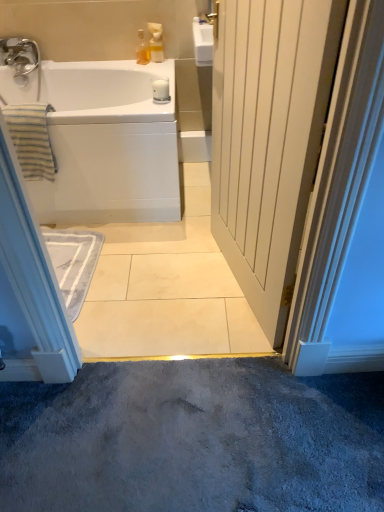
What do you see at coordinates (156, 42) in the screenshot? I see `white glossy soap dispenser at upper center, marked as the 2th toiletry in a left-to-right arrangement` at bounding box center [156, 42].

Describe the element at coordinates (109, 144) in the screenshot. This screenshot has width=384, height=512. I see `white glossy bathtub at upper left` at that location.

In order to click on white glossy soap dispenser at upper center, which is the first toiletry in right-to-left order in this screenshot , I will do `click(156, 42)`.

Can you confirm if white glossy bathtub at upper left is positioned to the right of white glossy soap dispenser at upper center, which is the first toiletry in right-to-left order?

Incorrect, white glossy bathtub at upper left is not on the right side of white glossy soap dispenser at upper center, which is the first toiletry in right-to-left order.

From the image's perspective, would you say white glossy bathtub at upper left is shown under white glossy soap dispenser at upper center, which is the first toiletry in right-to-left order?

Yes.

Which of these two, white glossy bathtub at upper left or white glossy soap dispenser at upper center, which is the first toiletry in right-to-left order, is smaller?

white glossy soap dispenser at upper center, which is the first toiletry in right-to-left order, is smaller.

Is white glossy bathtub at upper left oriented towards white glossy soap dispenser at upper center, which is the first toiletry in right-to-left order?

No, white glossy bathtub at upper left is not oriented towards white glossy soap dispenser at upper center, which is the first toiletry in right-to-left order.

Which is further, (x=146, y=59) or (x=22, y=134)?

Positioned behind is point (x=146, y=59).

How different are the orientations of translucent glass bottle at upper center, placed as the first toiletry when sorted from left to right, and striped cotton towel at left in degrees?

translucent glass bottle at upper center, placed as the first toiletry when sorted from left to right, and striped cotton towel at left are facing 30.7 degrees away from each other.

Between translucent glass bottle at upper center, marked as the second toiletry in a right-to-left arrangement, and striped cotton towel at left, which one has more height?

Standing taller between the two is striped cotton towel at left.

Which is more to the left, white wood door at center or white glossy soap dispenser at upper center, which is the first toiletry in right-to-left order?

Positioned to the left is white glossy soap dispenser at upper center, which is the first toiletry in right-to-left order.

Does white wood door at center have a smaller size compared to white glossy soap dispenser at upper center, marked as the 2th toiletry in a left-to-right arrangement?

No, white wood door at center is not smaller than white glossy soap dispenser at upper center, marked as the 2th toiletry in a left-to-right arrangement.

Does white wood door at center have a lesser width compared to white glossy soap dispenser at upper center, marked as the 2th toiletry in a left-to-right arrangement?

In fact, white wood door at center might be wider than white glossy soap dispenser at upper center, marked as the 2th toiletry in a left-to-right arrangement.

How many degrees apart are the facing directions of striped cotton towel at left and white glossy bathtub at upper left?

0.769 degrees separate the facing orientations of striped cotton towel at left and white glossy bathtub at upper left.

Can you see striped cotton towel at left touching white glossy bathtub at upper left?

striped cotton towel at left and white glossy bathtub at upper left are clearly separated.

Is striped cotton towel at left completely or partially outside of white glossy bathtub at upper left?

No.

Is point (41, 105) more distant than point (74, 182)?

Yes, point (41, 105) is farther from viewer.

Does point (147, 52) come farther from viewer compared to point (161, 42)?

No.

From the image's perspective, which one is positioned higher, translucent glass bottle at upper center, placed as the first toiletry when sorted from left to right, or white glossy soap dispenser at upper center, marked as the 2th toiletry in a left-to-right arrangement?

white glossy soap dispenser at upper center, marked as the 2th toiletry in a left-to-right arrangement, is shown above in the image.

Considering the relative sizes of translucent glass bottle at upper center, marked as the second toiletry in a right-to-left arrangement, and white glossy soap dispenser at upper center, marked as the 2th toiletry in a left-to-right arrangement, in the image provided, is translucent glass bottle at upper center, marked as the second toiletry in a right-to-left arrangement, thinner than white glossy soap dispenser at upper center, marked as the 2th toiletry in a left-to-right arrangement,?

Yes.

Is striped cotton towel at left with white glossy soap dispenser at upper center, marked as the 2th toiletry in a left-to-right arrangement?

striped cotton towel at left and white glossy soap dispenser at upper center, marked as the 2th toiletry in a left-to-right arrangement, are not in contact.

From the image's perspective, would you say striped cotton towel at left is positioned over white glossy soap dispenser at upper center, which is the first toiletry in right-to-left order?

No, from the image's perspective, striped cotton towel at left is not above white glossy soap dispenser at upper center, which is the first toiletry in right-to-left order.

Between striped cotton towel at left and white glossy soap dispenser at upper center, marked as the 2th toiletry in a left-to-right arrangement, which one has larger width?

With larger width is striped cotton towel at left.

Between striped cotton towel at left and white glossy soap dispenser at upper center, which is the first toiletry in right-to-left order, which one is positioned behind?

white glossy soap dispenser at upper center, which is the first toiletry in right-to-left order, is further from the camera.

Can you confirm if white wood door at center is bigger than white glossy bathtub at upper left?

No, white wood door at center is not bigger than white glossy bathtub at upper left.

Relative to white glossy bathtub at upper left, is white wood door at center in front or behind?

white wood door at center is in front of white glossy bathtub at upper left.

From the image's perspective, between white wood door at center and white glossy bathtub at upper left, which one is located above?

white glossy bathtub at upper left appears higher in the image.

At what (x,y) coordinates should I click in order to perform the action: click on door below the white glossy bathtub at upper left (from the image's perspective). Please return your answer as a coordinate pair (x, y). The width and height of the screenshot is (384, 512). Looking at the image, I should click on (269, 139).

Locate an element on the screen. the 2nd toiletry located above the white glossy bathtub at upper left (from a real-world perspective) is located at coordinates (156, 42).

In order to click on bath towel located on the left of translucent glass bottle at upper center, placed as the first toiletry when sorted from left to right in this screenshot , I will do `click(32, 139)`.

Estimate the real-world distances between objects in this image. Which object is further from striped cotton towel at left, white wood door at center or translucent glass bottle at upper center, marked as the second toiletry in a right-to-left arrangement?

Among the two, white wood door at center is located further to striped cotton towel at left.

In the scene shown: Which object lies further to the anchor point white wood door at center, striped cotton towel at left or white glossy bathtub at upper left?

striped cotton towel at left.

Considering their positions, is white wood door at center positioned closer to white glossy soap dispenser at upper center, which is the first toiletry in right-to-left order, than translucent glass bottle at upper center, placed as the first toiletry when sorted from left to right?

translucent glass bottle at upper center, placed as the first toiletry when sorted from left to right, lies closer to white glossy soap dispenser at upper center, which is the first toiletry in right-to-left order, than the other object.

From the image, which object appears to be farther from white glossy bathtub at upper left, white glossy soap dispenser at upper center, marked as the 2th toiletry in a left-to-right arrangement, or striped cotton towel at left?

white glossy soap dispenser at upper center, marked as the 2th toiletry in a left-to-right arrangement.

Consider the image. From the image, which object appears to be nearer to white glossy bathtub at upper left, striped cotton towel at left or translucent glass bottle at upper center, marked as the second toiletry in a right-to-left arrangement?

striped cotton towel at left lies closer to white glossy bathtub at upper left than the other object.

From the image, which object appears to be nearer to white glossy soap dispenser at upper center, which is the first toiletry in right-to-left order, white glossy bathtub at upper left or translucent glass bottle at upper center, marked as the second toiletry in a right-to-left arrangement?

Based on the image, translucent glass bottle at upper center, marked as the second toiletry in a right-to-left arrangement, appears to be nearer to white glossy soap dispenser at upper center, which is the first toiletry in right-to-left order.

In the scene shown: Which object lies further to the anchor point white wood door at center, white glossy soap dispenser at upper center, which is the first toiletry in right-to-left order, or white glossy bathtub at upper left?

white glossy soap dispenser at upper center, which is the first toiletry in right-to-left order, lies further to white wood door at center than the other object.

Estimate the real-world distances between objects in this image. Which object is closer to white glossy bathtub at upper left, striped cotton towel at left or white wood door at center?

striped cotton towel at left is closer to white glossy bathtub at upper left.

Identify the location of toiletry between white wood door at center and translucent glass bottle at upper center, placed as the first toiletry when sorted from left to right, in the front-back direction. This screenshot has height=512, width=384. (156, 42).

Identify the location of bathtub between white wood door at center and translucent glass bottle at upper center, placed as the first toiletry when sorted from left to right, in the front-back direction. This screenshot has width=384, height=512. (109, 144).

I want to click on toiletry between white glossy soap dispenser at upper center, marked as the 2th toiletry in a left-to-right arrangement, and white glossy bathtub at upper left from top to bottom, so click(x=142, y=49).

Locate an element on the screen. The width and height of the screenshot is (384, 512). bath towel located between white wood door at center and white glossy soap dispenser at upper center, which is the first toiletry in right-to-left order, in the depth direction is located at coordinates (32, 139).